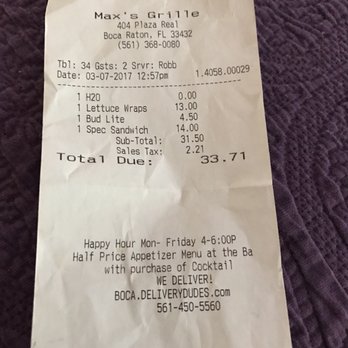
Locate an element on the screen. purple tablecloth is located at coordinates (319, 113).